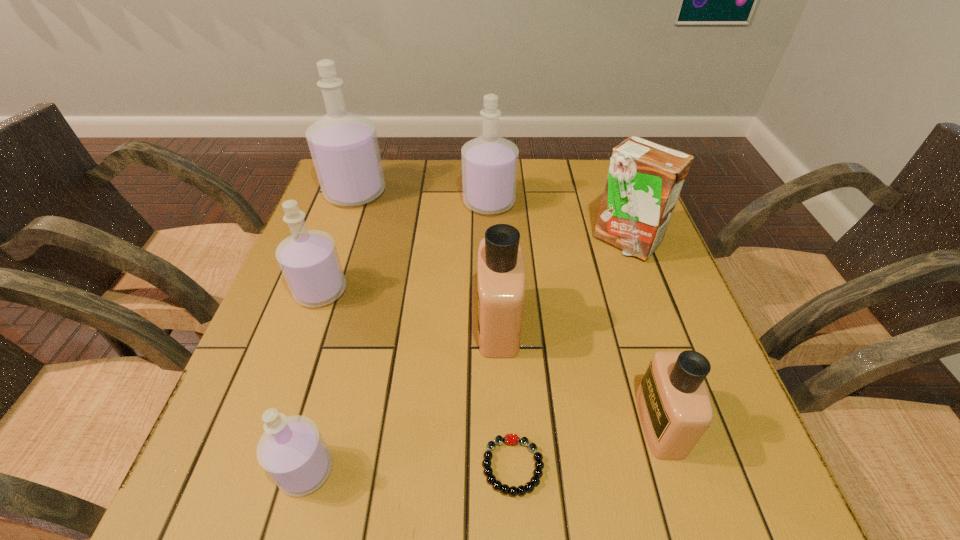
The image size is (960, 540). Identify the location of purple perfume that is the second closest to the carton. (344, 147).

What are the coordinates of `vacant space that satisfies the following two spatial constraints: 1. on the straw side of the third farthest object; 2. on the front label of the smaller beige perfume` in the screenshot? It's located at (690, 423).

In order to click on vacant region that satisfies the following two spatial constraints: 1. on the front side of the fifth shortest perfume; 2. on the right side of the black bracelet in this screenshot , I will do `click(495, 466)`.

At what (x,y) coordinates should I click in order to perform the action: click on free space that satisfies the following two spatial constraints: 1. on the straw side of the third farthest object; 2. on the front label of the farther beige perfume. Please return your answer as a coordinate pair (x, y). This screenshot has height=540, width=960. Looking at the image, I should click on (655, 323).